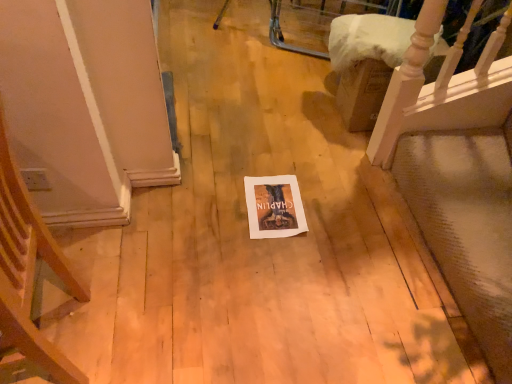
At what (x,y) coordinates should I click in order to perform the action: click on vacant space that is in between wooden armchair at left and white paper at center. Please return your answer as a coordinate pair (x, y). Image resolution: width=512 pixels, height=384 pixels. Looking at the image, I should click on (188, 268).